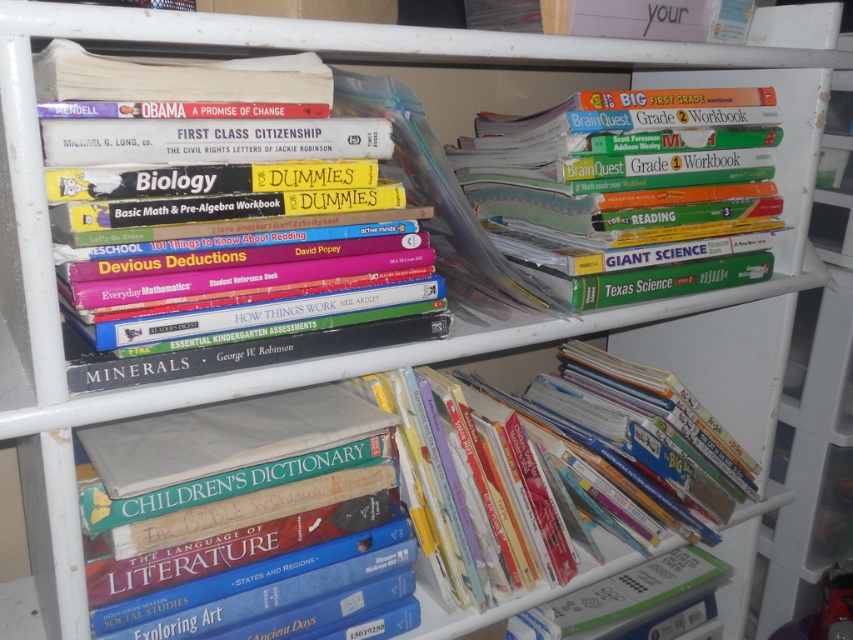
You are organizing the white metal shelving unit and notice two items. You have the hardcover books at center and the hardcover book at lower right. If you want to place both items side by side on a shelf that can only hold items up to 20 cm in total width, can they fit together?

The hardcover books at center might be wider than the hardcover book at lower right. However, since the total width of both items together is unknown, it is uncertain if they will fit within the 20 cm limit. You should measure both to confirm.